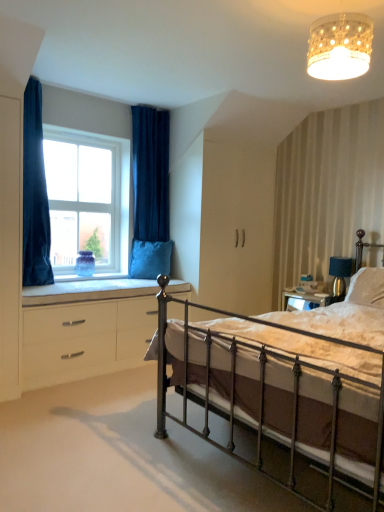
Question: From a real-world perspective, is velvet blue curtain at upper left, placed as the 2th curtain when sorted from front to back, above or below velvet blue pillow at window, which is counted as the 2th pillow, starting from the right?

Choices:
 (A) above
 (B) below

Answer: (A)

Question: From the image's perspective, is velvet blue curtain at upper left, acting as the 1th curtain starting from the back, located above or below velvet blue pillow at window, placed as the first pillow when sorted from back to front?

Choices:
 (A) below
 (B) above

Answer: (B)

Question: Estimate the real-world distances between objects in this image. Which object is closer to the velvet blue pillow at window, placed as the first pillow when sorted from back to front?

Choices:
 (A) velvet blue curtain at left, marked as the 2th curtain in a back-to-front arrangement
 (B) white glossy chest of drawers at lower left
 (C) velvet blue curtain at upper left, acting as the 1th curtain starting from the back
 (D) blue velvet cushion at lower left
 (E) white textured lampshade at upper center

Answer: (D)

Question: Which of these objects is positioned closest to the white textured pillow at right, the second pillow in the back-to-front sequence?

Choices:
 (A) velvet blue curtain at upper left, placed as the 2th curtain when sorted from front to back
 (B) blue velvet cushion at lower left
 (C) velvet blue pillow at window, which is counted as the 2th pillow, starting from the right
 (D) white textured lampshade at upper center
 (E) white glass window at upper left

Answer: (D)